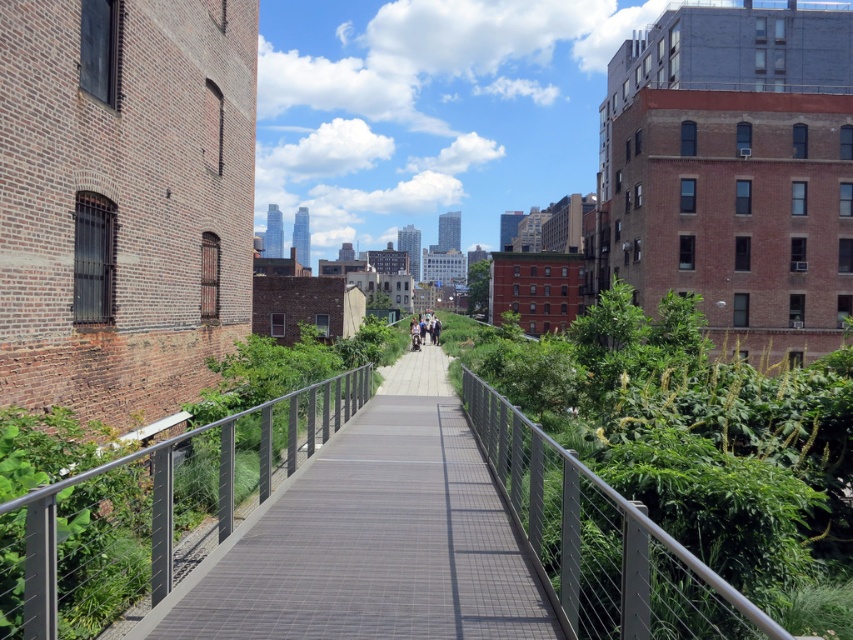
Is metal/rigid rail at center taller than metallic gray rail at center?

Yes.

Consider the image. Is metal/rigid rail at center to the right of metallic gray rail at center from the viewer's perspective?

No, metal/rigid rail at center is not to the right of metallic gray rail at center.

The image size is (853, 640). Describe the element at coordinates (152, 509) in the screenshot. I see `metal/rigid rail at center` at that location.

At what (x,y) coordinates should I click in order to perform the action: click on metal/rigid rail at center. Please return your answer as a coordinate pair (x, y). The width and height of the screenshot is (853, 640). Looking at the image, I should click on (152, 509).

Is metallic gray rail at center wider than light brown wooden bench at center?

In fact, metallic gray rail at center might be narrower than light brown wooden bench at center.

Is metallic gray rail at center above light brown wooden bench at center?

No, metallic gray rail at center is not above light brown wooden bench at center.

Find the location of a particular element. This screenshot has height=640, width=853. metallic gray rail at center is located at coordinates (601, 540).

This screenshot has height=640, width=853. Find the location of `metallic gray rail at center`. metallic gray rail at center is located at coordinates pyautogui.click(x=601, y=540).

Can you confirm if metallic gray bridge at center is thinner than metallic gray rail at center?

In fact, metallic gray bridge at center might be wider than metallic gray rail at center.

Is metallic gray bridge at center taller than metallic gray rail at center?

Yes.

Identify the location of metallic gray bridge at center. (152, 509).

The height and width of the screenshot is (640, 853). I want to click on metallic gray bridge at center, so click(x=152, y=509).